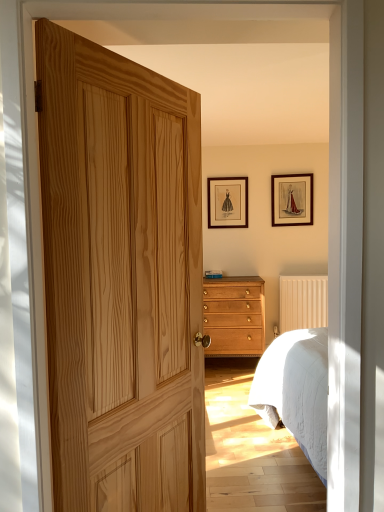
This screenshot has height=512, width=384. What do you see at coordinates (292, 199) in the screenshot?
I see `wooden picture frame at upper right, acting as the 1th picture frame starting from the right` at bounding box center [292, 199].

The image size is (384, 512). In order to click on beige textured radiator at center right in this screenshot , I will do `click(303, 302)`.

In order to click on matte black picture frame at upper center, marked as the second picture frame in a right-to-left arrangement in this screenshot , I will do `click(228, 202)`.

Which object is positioned more to the right, matte black picture frame at upper center, which is the 1th picture frame from left to right, or beige textured radiator at center right?

Positioned to the right is beige textured radiator at center right.

Where is `radiator below the matte black picture frame at upper center, marked as the second picture frame in a right-to-left arrangement (from a real-world perspective)`? The image size is (384, 512). radiator below the matte black picture frame at upper center, marked as the second picture frame in a right-to-left arrangement (from a real-world perspective) is located at coordinates (303, 302).

How different are the orientations of matte black picture frame at upper center, which is the 1th picture frame from left to right, and beige textured radiator at center right in degrees?

There is a 0.0166-degree angle between the facing directions of matte black picture frame at upper center, which is the 1th picture frame from left to right, and beige textured radiator at center right.

Which of these two, wooden picture frame at upper right, acting as the 1th picture frame starting from the right, or natural wood door at center, is thinner?

wooden picture frame at upper right, acting as the 1th picture frame starting from the right.

Based on their sizes in the image, would you say wooden picture frame at upper right, acting as the 1th picture frame starting from the right, is bigger or smaller than natural wood door at center?

wooden picture frame at upper right, acting as the 1th picture frame starting from the right, is smaller than natural wood door at center.

Who is taller, wooden picture frame at upper right, the 2th picture frame from the left, or natural wood door at center?

natural wood door at center.

Do you think matte black picture frame at upper center, marked as the second picture frame in a right-to-left arrangement, is within natural wood door at center, or outside of it?

matte black picture frame at upper center, marked as the second picture frame in a right-to-left arrangement, is spatially situated outside natural wood door at center.

From the image's perspective, which one is positioned higher, matte black picture frame at upper center, marked as the second picture frame in a right-to-left arrangement, or natural wood door at center?

matte black picture frame at upper center, marked as the second picture frame in a right-to-left arrangement, from the image's perspective.

This screenshot has width=384, height=512. What are the coordinates of `door on the left of matte black picture frame at upper center, marked as the second picture frame in a right-to-left arrangement` in the screenshot? It's located at (121, 279).

Does matte black picture frame at upper center, which is the 1th picture frame from left to right, come behind natural wood door at center?

Yes, the depth of matte black picture frame at upper center, which is the 1th picture frame from left to right, is greater than that of natural wood door at center.

Can you see matte black picture frame at upper center, which is the 1th picture frame from left to right, touching wooden picture frame at upper right, the 2th picture frame from the left?

No, matte black picture frame at upper center, which is the 1th picture frame from left to right, is not with wooden picture frame at upper right, the 2th picture frame from the left.

From the picture: Is matte black picture frame at upper center, marked as the second picture frame in a right-to-left arrangement, positioned behind wooden picture frame at upper right, acting as the 1th picture frame starting from the right?

Yes, it is behind wooden picture frame at upper right, acting as the 1th picture frame starting from the right.

Is matte black picture frame at upper center, which is the 1th picture frame from left to right, at the right side of wooden picture frame at upper right, the 2th picture frame from the left?

No, matte black picture frame at upper center, which is the 1th picture frame from left to right, is not to the right of wooden picture frame at upper right, the 2th picture frame from the left.

Does light brown wood chest of drawers at center have a lesser height compared to beige textured radiator at center right?

Incorrect, the height of light brown wood chest of drawers at center does not fall short of that of beige textured radiator at center right.

Considering the relative positions of light brown wood chest of drawers at center and beige textured radiator at center right in the image provided, is light brown wood chest of drawers at center in front of beige textured radiator at center right?

Yes, light brown wood chest of drawers at center is closer to the camera.

Is point (228, 321) positioned behind point (288, 291)?

No.

Is light brown wood chest of drawers at center placed right next to beige textured radiator at center right?

No, light brown wood chest of drawers at center is not touching beige textured radiator at center right.

Does light brown wood chest of drawers at center have a greater width compared to wooden picture frame at upper right, the 2th picture frame from the left?

Yes.

Considering the positions of objects light brown wood chest of drawers at center and wooden picture frame at upper right, the 2th picture frame from the left, in the image provided, who is more to the right, light brown wood chest of drawers at center or wooden picture frame at upper right, the 2th picture frame from the left,?

Positioned to the right is wooden picture frame at upper right, the 2th picture frame from the left.

Where is `the chest of drawers located in front of the wooden picture frame at upper right, acting as the 1th picture frame starting from the right`? The height and width of the screenshot is (512, 384). the chest of drawers located in front of the wooden picture frame at upper right, acting as the 1th picture frame starting from the right is located at coordinates (234, 316).

From a real-world perspective, is light brown wood chest of drawers at center above or below wooden picture frame at upper right, the 2th picture frame from the left?

In terms of real-world spatial position, light brown wood chest of drawers at center is below wooden picture frame at upper right, the 2th picture frame from the left.

Is beige textured radiator at center right behind natural wood door at center?

Yes, the depth of beige textured radiator at center right is greater than that of natural wood door at center.

Considering the sizes of objects beige textured radiator at center right and natural wood door at center in the image provided, who is taller, beige textured radiator at center right or natural wood door at center?

natural wood door at center.

Is point (302, 295) closer or farther from the camera than point (101, 273)?

Point (302, 295) is farther from the camera than point (101, 273).

From the picture: Is beige textured radiator at center right not close to natural wood door at center?

Absolutely, beige textured radiator at center right is distant from natural wood door at center.

From a real-world perspective, which picture frame is the 2nd one above the beige textured radiator at center right? Please provide its 2D coordinates.

[(228, 202)]

From the natural wood door at center, count 1st picture frames backward and point to it. Please provide its 2D coordinates.

[(292, 199)]

Based on their spatial positions, is natural wood door at center or wooden picture frame at upper right, acting as the 1th picture frame starting from the right, further from matte black picture frame at upper center, which is the 1th picture frame from left to right?

natural wood door at center.

From the image, which object appears to be farther from wooden picture frame at upper right, the 2th picture frame from the left, matte black picture frame at upper center, marked as the second picture frame in a right-to-left arrangement, or natural wood door at center?

Among the two, natural wood door at center is located further to wooden picture frame at upper right, the 2th picture frame from the left.

Based on their spatial positions, is natural wood door at center or beige textured radiator at center right further from light brown wood chest of drawers at center?

natural wood door at center.

When comparing their distances from natural wood door at center, does matte black picture frame at upper center, marked as the second picture frame in a right-to-left arrangement, or beige textured radiator at center right seem further?

beige textured radiator at center right.

When comparing their distances from wooden picture frame at upper right, the 2th picture frame from the left, does beige textured radiator at center right or matte black picture frame at upper center, marked as the second picture frame in a right-to-left arrangement, seem closer?

matte black picture frame at upper center, marked as the second picture frame in a right-to-left arrangement, is closer to wooden picture frame at upper right, the 2th picture frame from the left.

From the image, which object appears to be farther from natural wood door at center, light brown wood chest of drawers at center or beige textured radiator at center right?

beige textured radiator at center right is further to natural wood door at center.

From the image, which object appears to be nearer to natural wood door at center, matte black picture frame at upper center, which is the 1th picture frame from left to right, or light brown wood chest of drawers at center?

light brown wood chest of drawers at center is closer to natural wood door at center.

Considering their positions, is beige textured radiator at center right positioned further to wooden picture frame at upper right, the 2th picture frame from the left, than light brown wood chest of drawers at center?

light brown wood chest of drawers at center lies further to wooden picture frame at upper right, the 2th picture frame from the left, than the other object.

Locate an element on the screen. chest of drawers between natural wood door at center and matte black picture frame at upper center, which is the 1th picture frame from left to right, in the front-back direction is located at coordinates (234, 316).

Locate an element on the screen. Image resolution: width=384 pixels, height=512 pixels. radiator between matte black picture frame at upper center, which is the 1th picture frame from left to right, and light brown wood chest of drawers at center in the up-down direction is located at coordinates (303, 302).

At what (x,y) coordinates should I click in order to perform the action: click on radiator between natural wood door at center and matte black picture frame at upper center, which is the 1th picture frame from left to right, from front to back. Please return your answer as a coordinate pair (x, y). This screenshot has width=384, height=512. Looking at the image, I should click on (303, 302).

Find the location of a particular element. the chest of drawers positioned between natural wood door at center and wooden picture frame at upper right, the 2th picture frame from the left, from near to far is located at coordinates (234, 316).